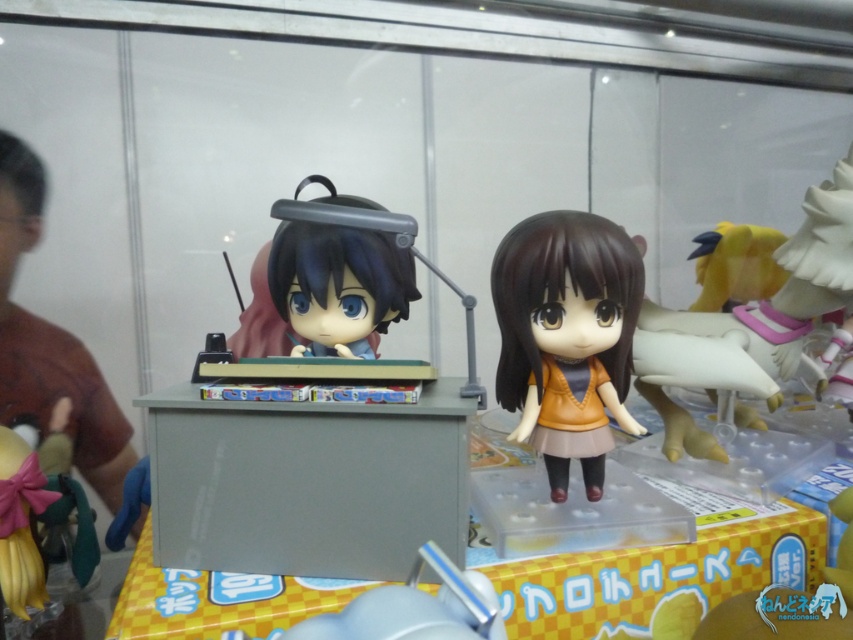
Does gray matte cabinet at center have a smaller size compared to yellow matte plush toy at upper right?

Incorrect, gray matte cabinet at center is not smaller in size than yellow matte plush toy at upper right.

Between gray matte cabinet at center and yellow matte plush toy at upper right, which one appears on the left side from the viewer's perspective?

Positioned to the left is gray matte cabinet at center.

Identify the location of gray matte cabinet at center. The width and height of the screenshot is (853, 640). (306, 483).

Between brown matte doll at center and yellow matte plush toy at upper right, which one is positioned higher?

yellow matte plush toy at upper right is higher up.

Does brown matte doll at center have a greater width compared to yellow matte plush toy at upper right?

Indeed, brown matte doll at center has a greater width compared to yellow matte plush toy at upper right.

Who is more distant from viewer, (558,413) or (746,237)?

The point (746,237) is behind.

Locate an element on the screen. The height and width of the screenshot is (640, 853). brown matte doll at center is located at coordinates (566, 321).

Does gray matte cabinet at center have a lesser height compared to brown matte doll at center?

Yes.

From the picture: Does gray matte cabinet at center have a greater height compared to brown matte doll at center?

No.

Which is behind, point (312, 413) or point (544, 332)?

The point (544, 332) is behind.

Locate an element on the screen. This screenshot has width=853, height=640. gray matte cabinet at center is located at coordinates (306, 483).